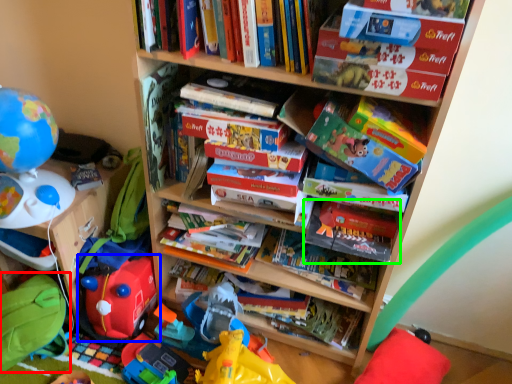
Question: Which is nearer to the bean bag chair (highlighted by a red box)? toy (highlighted by a blue box) or paperback book (highlighted by a green box).

Choices:
 (A) toy
 (B) paperback book

Answer: (A)